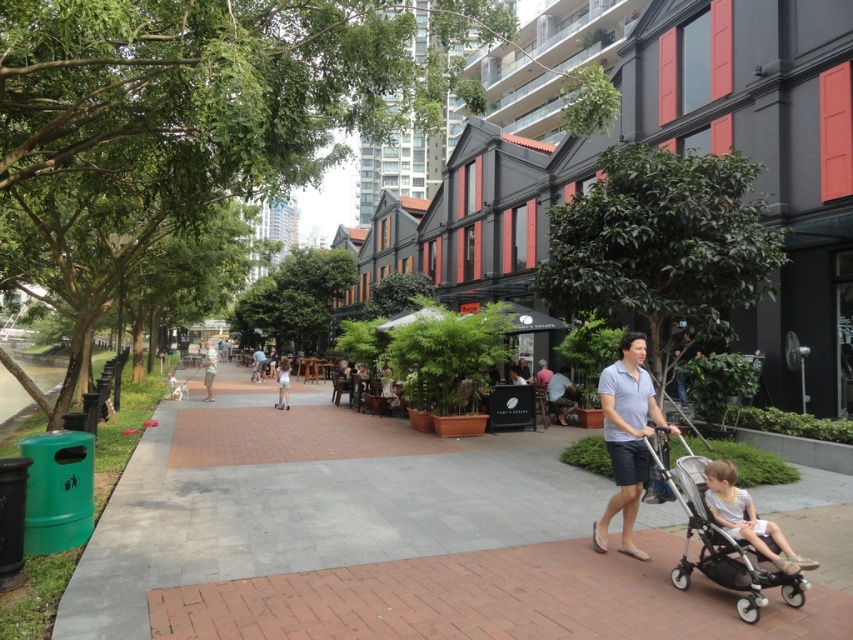
You are standing on the brick pavement at center and want to see the top of the white fabric dress at center. Can you see it without moving your head?

The brick pavement at center is not as tall as white fabric dress at center, so yes, you can see the top of the white fabric dress at center without moving your head because the dress is taller than the pavement.

You are standing at the point labeled point (x=608, y=452). You want to walk to the point labeled point (x=209, y=356). Which direction should you move relative to your current position?

Since point (x=608, y=452) is closer to the camera than point (x=209, y=356), you should move backward to reach point (x=209, y=356) from your current position.